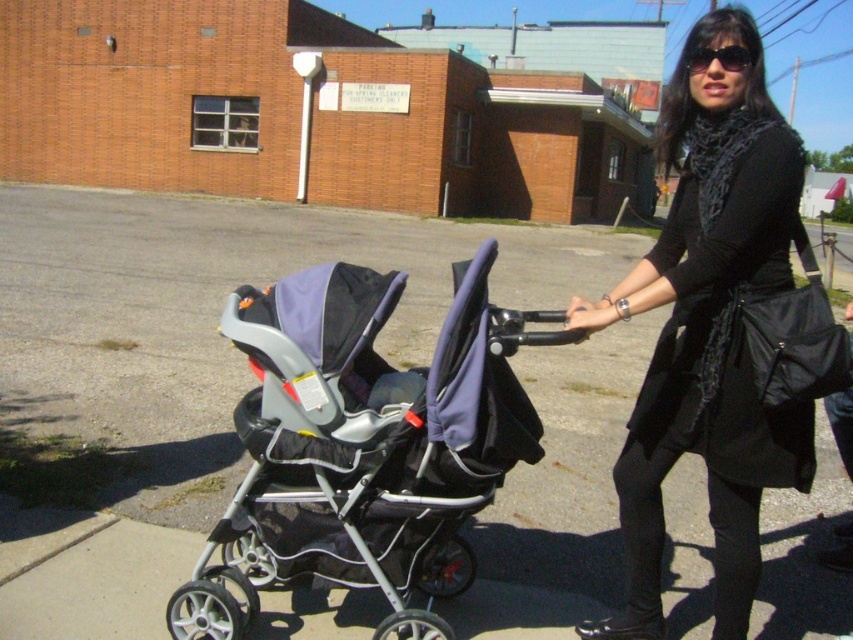
You are a delivery person who needs to carry a 2.0 meter long package through the path between the silver metallic stroller at center and the black matte coat at center. Can you pass through this path without tilting the package?

The distance between the silver metallic stroller at center and the black matte coat at center is 1.90 meters. Since the package is 2.0 meters long, it is longer than the available space, so you cannot pass through without tilting the package.

You are a photographer trying to capture a photo of the silver metallic stroller at center and the black matte coat at center. You want to ensure the stroller is on the left side of the coat in the final image. Based on the scene description, will your current positioning allow this composition?

Yes, the silver metallic stroller at center is already positioned to the left of the black matte coat at center, so your current positioning will allow the stroller to appear on the left side of the coat in the photo.